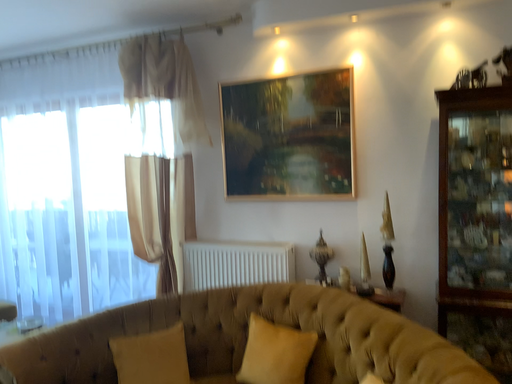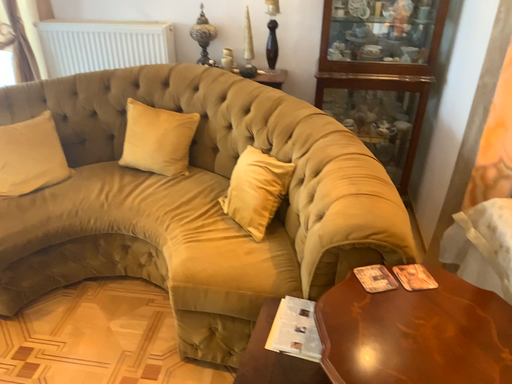
Question: How did the camera likely rotate when shooting the video?

Choices:
 (A) rotated left
 (B) rotated right

Answer: (B)